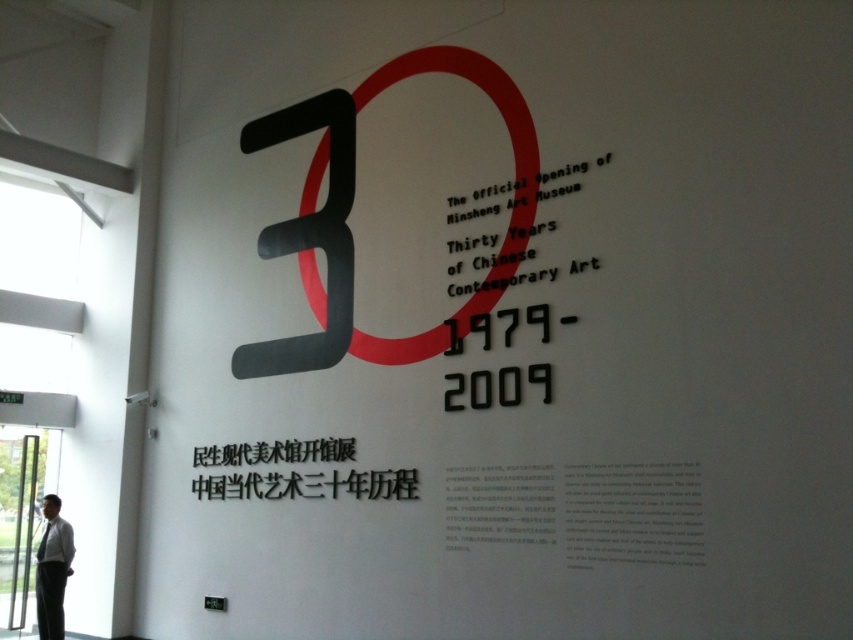
Question: Which point is farther from the camera taking this photo?

Choices:
 (A) (427, 342)
 (B) (198, 465)

Answer: (B)

Question: Which of the following is the farthest from the observer?

Choices:
 (A) black paper text at center
 (B) black metallic text at center
 (C) matte red circle at center
 (D) white shirt at lower left

Answer: (D)

Question: Can you confirm if matte red circle at center is smaller than black metallic text at center?

Choices:
 (A) yes
 (B) no

Answer: (B)

Question: Does matte red circle at center have a smaller size compared to white shirt at lower left?

Choices:
 (A) no
 (B) yes

Answer: (A)

Question: Observing the image, what is the correct spatial positioning of black paper text at center in reference to white shirt at lower left?

Choices:
 (A) below
 (B) above

Answer: (B)

Question: Which point is farther to the camera?

Choices:
 (A) black paper text at center
 (B) white shirt at lower left
 (C) black metallic text at center
 (D) matte red circle at center

Answer: (B)